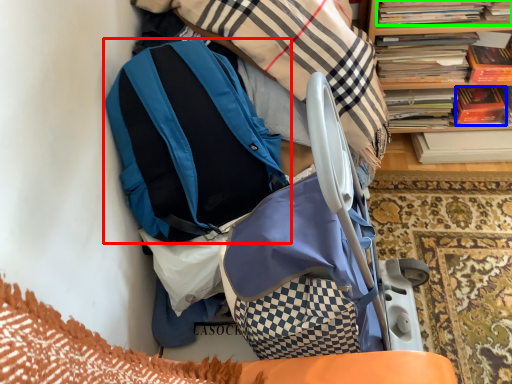
Question: Which is farther away from backpack (highlighted by a red box)? paperback book (highlighted by a blue box) or book (highlighted by a green box)?

Choices:
 (A) paperback book
 (B) book

Answer: (A)